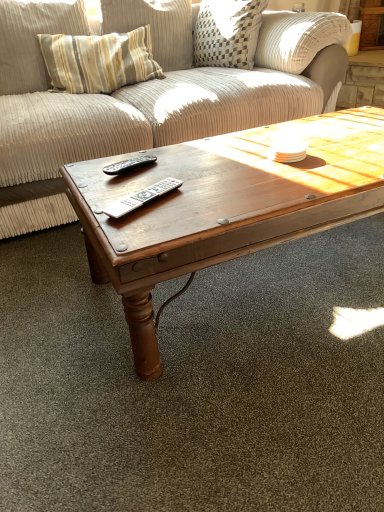
Locate an element on the screen. The height and width of the screenshot is (512, 384). wooden coffee table at center is located at coordinates (225, 206).

What do you see at coordinates (141, 198) in the screenshot? The height and width of the screenshot is (512, 384). I see `silver metallic remote at center, the first remote positioned from the bottom` at bounding box center [141, 198].

This screenshot has height=512, width=384. Describe the element at coordinates (32, 41) in the screenshot. I see `striped fabric pillow at upper left` at that location.

The image size is (384, 512). Identify the location of black plastic remote at center, the first remote from the back. (129, 164).

From the image's perspective, between silver metallic remote at center, marked as the second remote in a top-to-bottom arrangement, and black plastic remote at center, placed as the second remote when sorted from bottom to top, which one is located above?

black plastic remote at center, placed as the second remote when sorted from bottom to top, is shown above in the image.

Is silver metallic remote at center, marked as the second remote in a top-to-bottom arrangement, turned away from black plastic remote at center, which ranks as the 1th remote in top-to-bottom order?

No, silver metallic remote at center, marked as the second remote in a top-to-bottom arrangement,'s orientation is not away from black plastic remote at center, which ranks as the 1th remote in top-to-bottom order.

Is silver metallic remote at center, marked as the second remote in a top-to-bottom arrangement, thinner than black plastic remote at center, which ranks as the 1th remote in top-to-bottom order?

No.

From the picture: Considering the relative sizes of silver metallic remote at center, marked as the second remote in a top-to-bottom arrangement, and black plastic remote at center, which is counted as the 2th remote, starting from the front, in the image provided, is silver metallic remote at center, marked as the second remote in a top-to-bottom arrangement, bigger than black plastic remote at center, which is counted as the 2th remote, starting from the front,?

No.

Between striped fabric pillow at upper left and wooden coffee table at center, which one has smaller width?

Thinner between the two is striped fabric pillow at upper left.

What's the angular difference between striped fabric pillow at upper left and wooden coffee table at center's facing directions?

4.18 degrees separate the facing orientations of striped fabric pillow at upper left and wooden coffee table at center.

Is point (36, 69) closer or farther from the camera than point (343, 111)?

Point (36, 69) is positioned farther from the camera compared to point (343, 111).

Is striped fabric pillow at upper left oriented away from wooden coffee table at center?

striped fabric pillow at upper left does not have its back to wooden coffee table at center.

Is striped fabric pillow at upper left positioned with its back to black plastic remote at center, which is counted as the 2th remote, starting from the front?

No, striped fabric pillow at upper left is not facing the opposite direction of black plastic remote at center, which is counted as the 2th remote, starting from the front.

Which of these two, striped fabric pillow at upper left or black plastic remote at center, the first remote from the back, is wider?

With larger width is striped fabric pillow at upper left.

Considering their positions, is striped fabric pillow at upper left located in front of or behind black plastic remote at center, the first remote from the back?

striped fabric pillow at upper left is positioned farther from the viewer than black plastic remote at center, the first remote from the back.

At what (x,y) coordinates should I click in order to perform the action: click on the 1st remote below the striped fabric pillow at upper left (from the image's perspective). Please return your answer as a coordinate pair (x, y). Looking at the image, I should click on (129, 164).

Measure the distance from wooden coffee table at center to black plastic remote at center, which is counted as the 2th remote, starting from the front.

wooden coffee table at center and black plastic remote at center, which is counted as the 2th remote, starting from the front, are 33.75 centimeters apart from each other.

Does wooden coffee table at center have a lesser height compared to black plastic remote at center, which ranks as the 1th remote in top-to-bottom order?

In fact, wooden coffee table at center may be taller than black plastic remote at center, which ranks as the 1th remote in top-to-bottom order.

Looking at this image, considering the sizes of objects wooden coffee table at center and black plastic remote at center, the first remote from the back, in the image provided, who is thinner, wooden coffee table at center or black plastic remote at center, the first remote from the back,?

black plastic remote at center, the first remote from the back.

From the image's perspective, is wooden coffee table at center over black plastic remote at center, the first remote from the back?

No, from the image's perspective, wooden coffee table at center is not over black plastic remote at center, the first remote from the back.

Between silver metallic remote at center, which ranks as the 2th remote in back-to-front order, and wooden coffee table at center, which one has smaller size?

silver metallic remote at center, which ranks as the 2th remote in back-to-front order.

This screenshot has width=384, height=512. I want to click on coffee table on the right of silver metallic remote at center, placed as the first remote when sorted from front to back, so click(225, 206).

Does silver metallic remote at center, placed as the first remote when sorted from front to back, have a greater height compared to wooden coffee table at center?

Incorrect, the height of silver metallic remote at center, placed as the first remote when sorted from front to back, is not larger of that of wooden coffee table at center.

Choose the correct answer: Is silver metallic remote at center, placed as the first remote when sorted from front to back, inside wooden coffee table at center or outside it?

silver metallic remote at center, placed as the first remote when sorted from front to back, is located beyond the bounds of wooden coffee table at center.

From the picture: Could you tell me if black plastic remote at center, the first remote from the back, is turned towards wooden coffee table at center?

No, black plastic remote at center, the first remote from the back, does not turn towards wooden coffee table at center.

How far apart are black plastic remote at center, which ranks as the 1th remote in top-to-bottom order, and wooden coffee table at center?

black plastic remote at center, which ranks as the 1th remote in top-to-bottom order, and wooden coffee table at center are 13.29 inches apart from each other.

Consider the image. Is black plastic remote at center, which ranks as the 1th remote in top-to-bottom order, placed right next to wooden coffee table at center?

No, black plastic remote at center, which ranks as the 1th remote in top-to-bottom order, is not in contact with wooden coffee table at center.

Is black plastic remote at center, which ranks as the 1th remote in top-to-bottom order, shorter than wooden coffee table at center?

Yes, black plastic remote at center, which ranks as the 1th remote in top-to-bottom order, is shorter than wooden coffee table at center.

Does wooden coffee table at center lie behind striped fabric pillow at upper left?

No, it is not.

Which of these two, wooden coffee table at center or striped fabric pillow at upper left, is thinner?

striped fabric pillow at upper left is thinner.

Can you confirm if wooden coffee table at center is shorter than striped fabric pillow at upper left?

Correct, wooden coffee table at center is not as tall as striped fabric pillow at upper left.

Would you consider wooden coffee table at center to be distant from striped fabric pillow at upper left?

Yes, wooden coffee table at center is far from striped fabric pillow at upper left.

I want to click on remote below the black plastic remote at center, which ranks as the 1th remote in top-to-bottom order (from the image's perspective), so click(141, 198).

The height and width of the screenshot is (512, 384). In the image, there is a striped fabric pillow at upper left. Identify the location of coffee table below it (from a real-world perspective). (225, 206).

When comparing their distances from black plastic remote at center, placed as the second remote when sorted from bottom to top, does wooden coffee table at center or striped fabric pillow at upper left seem closer?

Among the two, wooden coffee table at center is located nearer to black plastic remote at center, placed as the second remote when sorted from bottom to top.

Which object lies further to the anchor point silver metallic remote at center, placed as the first remote when sorted from front to back, striped fabric pillow at upper left or black plastic remote at center, which ranks as the 1th remote in top-to-bottom order?

striped fabric pillow at upper left.

When comparing their distances from silver metallic remote at center, marked as the second remote in a top-to-bottom arrangement, does black plastic remote at center, the first remote from the back, or wooden coffee table at center seem closer?

black plastic remote at center, the first remote from the back, is closer to silver metallic remote at center, marked as the second remote in a top-to-bottom arrangement.

Based on the photo, looking at the image, which one is located closer to striped fabric pillow at upper left, wooden coffee table at center or black plastic remote at center, placed as the second remote when sorted from bottom to top?

black plastic remote at center, placed as the second remote when sorted from bottom to top.

Based on their spatial positions, is silver metallic remote at center, marked as the second remote in a top-to-bottom arrangement, or black plastic remote at center, which ranks as the 1th remote in top-to-bottom order, closer to wooden coffee table at center?

silver metallic remote at center, marked as the second remote in a top-to-bottom arrangement.

Estimate the real-world distances between objects in this image. Which object is closer to striped fabric pillow at upper left, silver metallic remote at center, marked as the second remote in a top-to-bottom arrangement, or wooden coffee table at center?

Among the two, wooden coffee table at center is located nearer to striped fabric pillow at upper left.

When comparing their distances from black plastic remote at center, which is counted as the 2th remote, starting from the front, does silver metallic remote at center, marked as the second remote in a top-to-bottom arrangement, or wooden coffee table at center seem closer?

Among the two, silver metallic remote at center, marked as the second remote in a top-to-bottom arrangement, is located nearer to black plastic remote at center, which is counted as the 2th remote, starting from the front.

Which object lies nearer to the anchor point silver metallic remote at center, marked as the second remote in a top-to-bottom arrangement, wooden coffee table at center or striped fabric pillow at upper left?

wooden coffee table at center is positioned closer to the anchor silver metallic remote at center, marked as the second remote in a top-to-bottom arrangement.

I want to click on remote situated between black plastic remote at center, which ranks as the 1th remote in top-to-bottom order, and wooden coffee table at center from left to right, so click(141, 198).

This screenshot has width=384, height=512. Identify the location of remote between striped fabric pillow at upper left and silver metallic remote at center, which ranks as the 2th remote in back-to-front order, vertically. (129, 164).